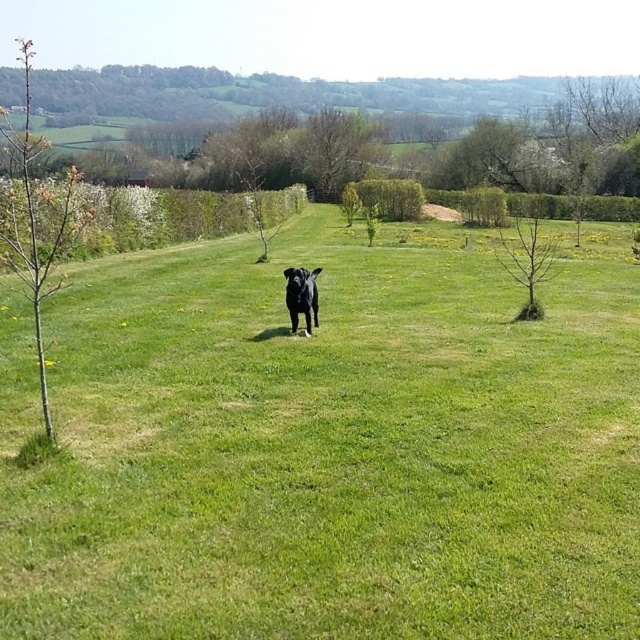
You are a photographer standing in the field. You want to take a photo of the black glossy dog at center and the bare branch tree at center. Which object is closer to you, the photographer?

The black glossy dog at center is behind the bare branch tree at center, so the bare branch tree at center is closer to you.

You are standing at the point marked by coordinates point (x=324, y=449) in the image. Looking around, you see the green grassy field at center. Which direction should you walk to reach the nearest small tree or shrub?

The nearest small tree or shrub is located in the direction away from the point (x=324, y=449) towards the scattered trees and shrubs in the field. Since the point is at the center of the green grassy field, moving towards the areas where the trees and shrubs are scattered would lead you to the nearest one.

You are standing in the middle of the field and see the bare branch tree at center and the black glossy dog at center. Which object is taller?

The bare branch tree at center is taller than the black glossy dog at center.